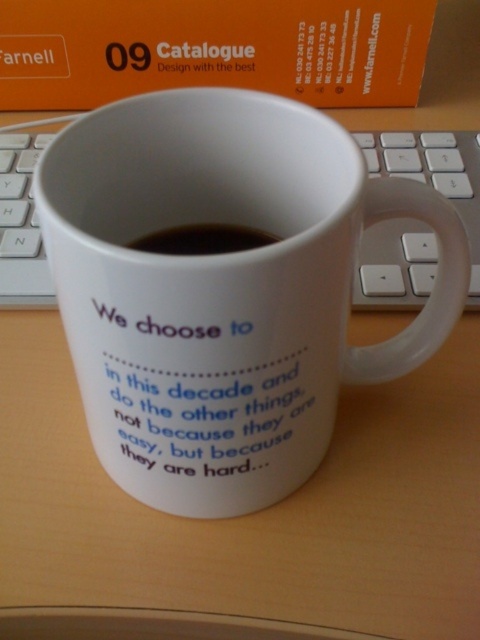
You are organizing a workspace and need to place a new item between the orange paper at upper center and the black liquid at center. Considering their heights, which object should be placed lower to ensure stability?

The orange paper at upper center is taller than the black liquid at center, so to ensure stability, the black liquid at center should be placed lower since it is shorter.

You are organizing your desk and need to move the white plastic keyboard at center. Can you move it forward without moving the orange paper at upper center?

The white plastic keyboard at center is behind the orange paper at upper center, so you can move it forward without affecting the orange paper at upper center.